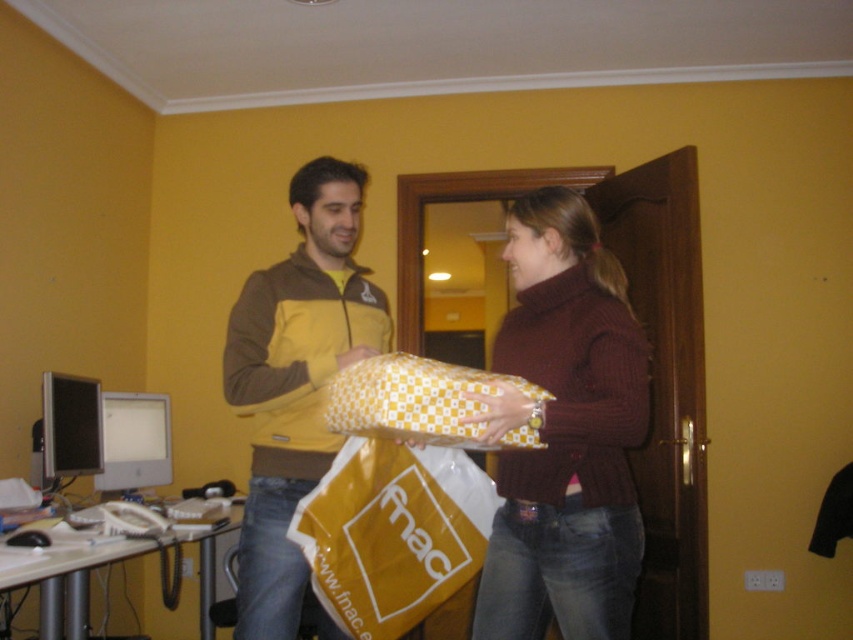
You are organizing a closet and see the yellow matte jacket at center and the yellow checkered fabric at center. Which item is located to the left of the other?

The yellow matte jacket at center is positioned on the left side of yellow checkered fabric at center.

You are organizing a desk and need to place both the yellow checkered paper at center and the knitted maroon sweater at center. Which item requires more desk space?

The yellow checkered paper at center requires more desk space because it is larger in size than the knitted maroon sweater at center.